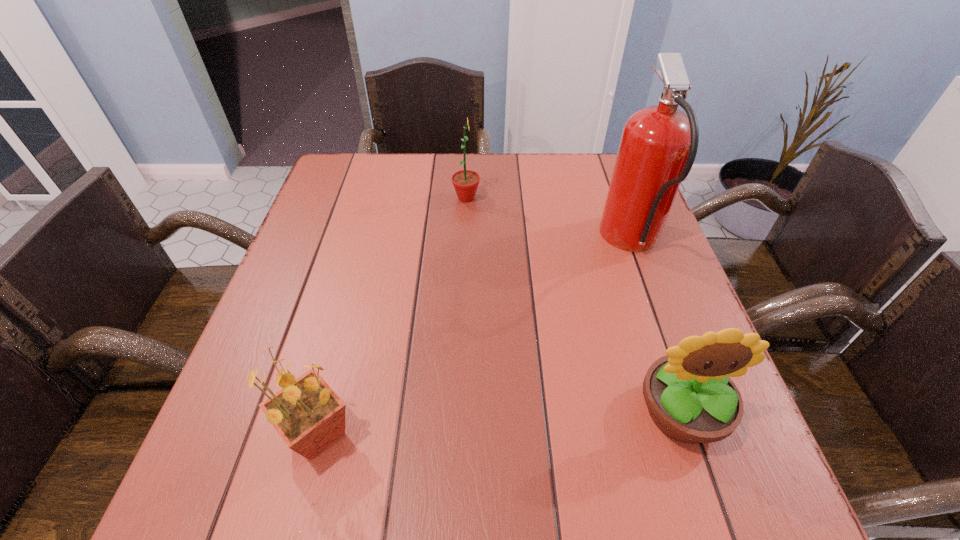
I want to click on free space that satisfies the following two spatial constraints: 1. with the handle and nozzle on the fire extinguisher; 2. at the front of the leftmost sunflower with flowers visible, so click(702, 434).